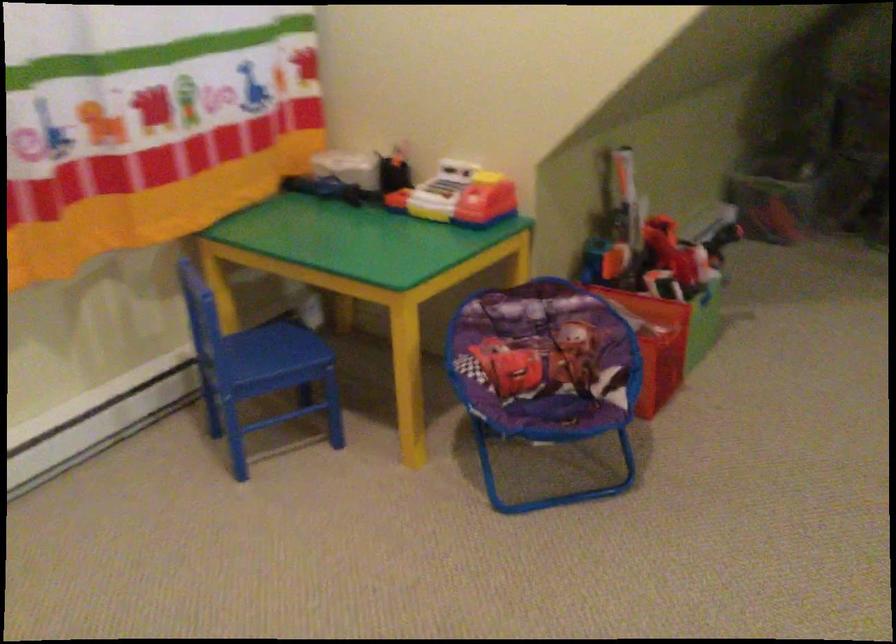
Where would you sit the purple chair sitting surface? Please return your answer as a coordinate pair (x, y).

(546, 372)